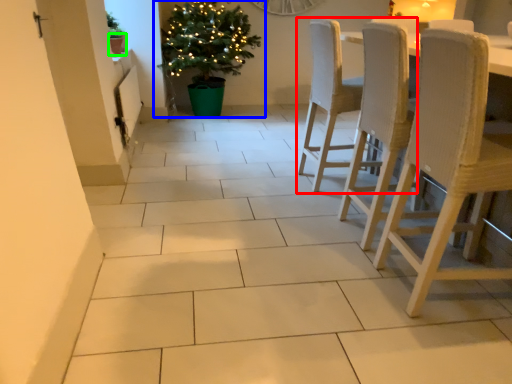
Question: Considering the real-world distances, which object is farthest from chair (highlighted by a red box)? houseplant (highlighted by a blue box) or flowerpot (highlighted by a green box)?

Choices:
 (A) houseplant
 (B) flowerpot

Answer: (B)